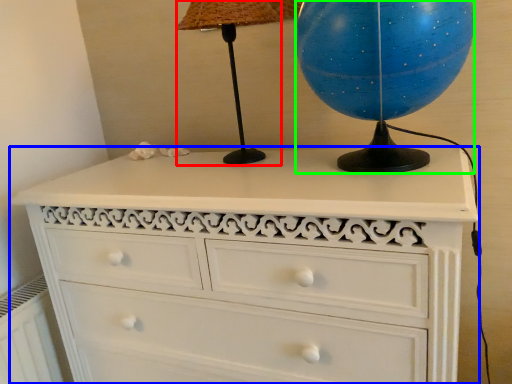
Question: Estimate the real-world distances between objects in this image. Which object is farther from table lamp (highlighted by a red box), chest of drawers (highlighted by a blue box) or sphere (highlighted by a green box)?

Choices:
 (A) chest of drawers
 (B) sphere

Answer: (A)